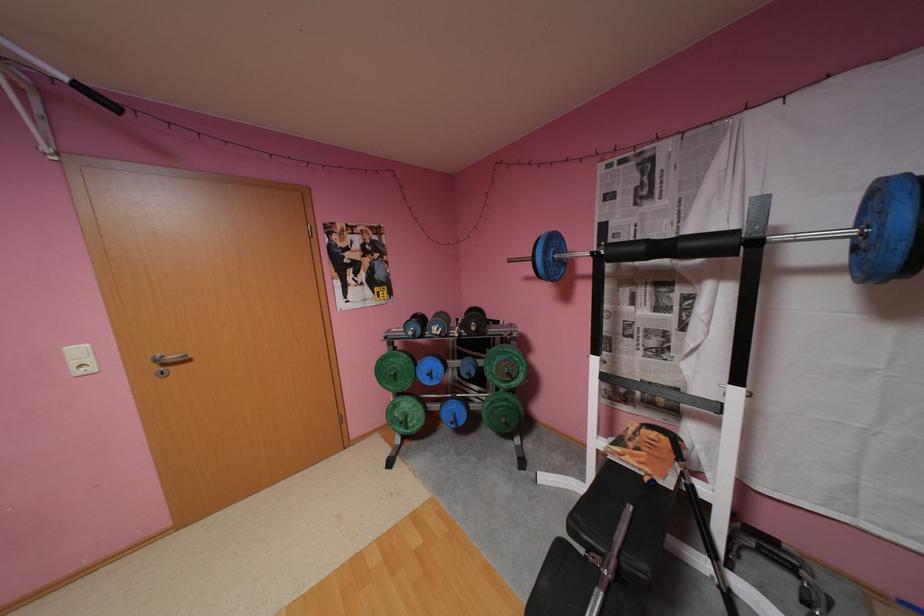
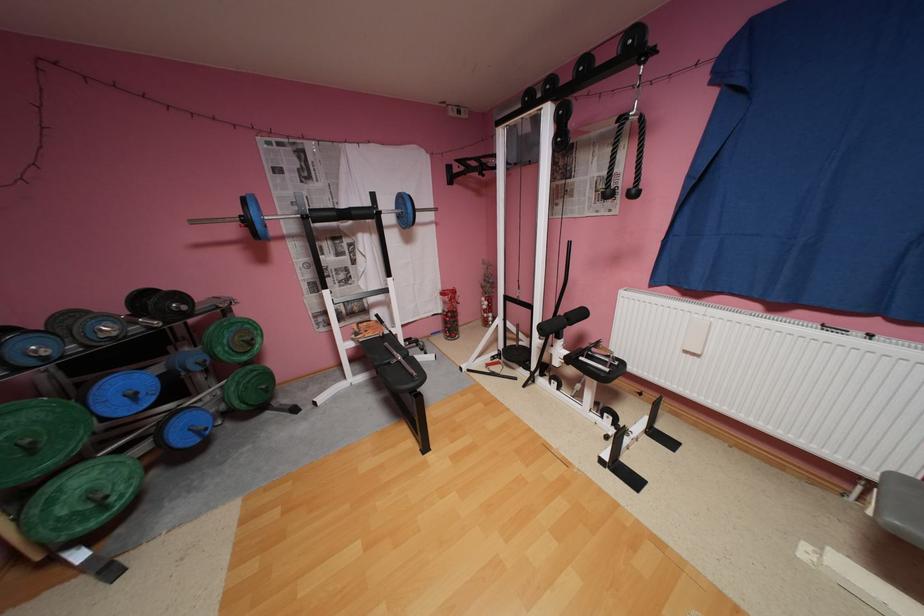
Locate, in the second image, the point that corresponds to point (691, 245) in the first image.

(362, 213)